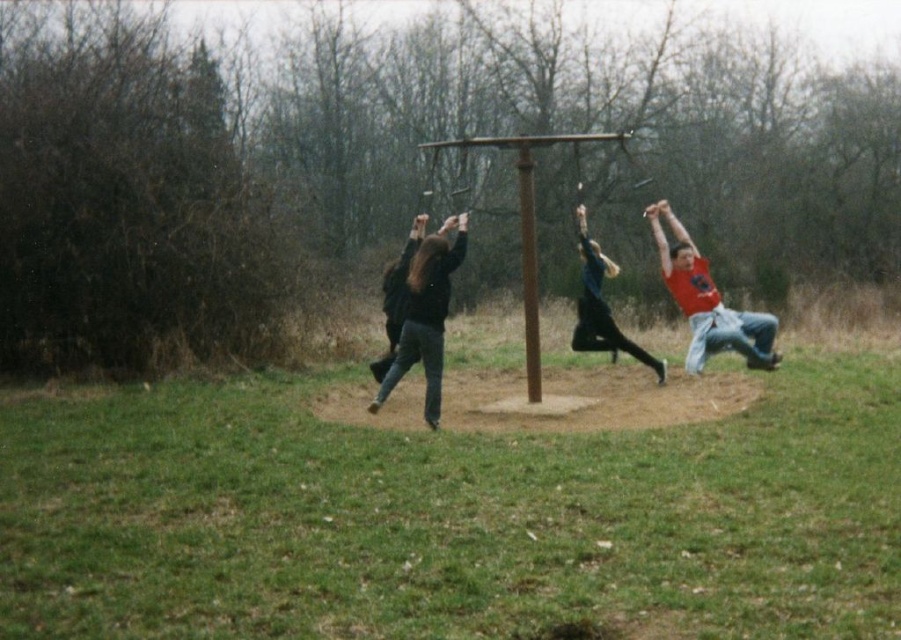
Can you confirm if black matte jacket at center is positioned to the right of black fabric pants at center?

In fact, black matte jacket at center is to the left of black fabric pants at center.

Who is positioned more to the left, black matte jacket at center or black fabric pants at center?

black matte jacket at center

Does point (426, 376) lie in front of point (604, 301)?

Yes, point (426, 376) is in front of point (604, 301).

Where is `black matte jacket at center`? black matte jacket at center is located at coordinates (426, 316).

Does black fabric pants at center appear over brown wooden pole at center?

No, black fabric pants at center is not above brown wooden pole at center.

Does black fabric pants at center have a lesser width compared to brown wooden pole at center?

No.

Between point (575, 328) and point (537, 396), which one is positioned behind?

Point (575, 328)

What are the coordinates of `black fabric pants at center` in the screenshot? It's located at (601, 307).

Is point (710, 308) positioned after point (615, 268)?

No, (710, 308) is in front of (615, 268).

Does red matte shirt at right have a smaller size compared to black fabric pants at center?

Incorrect, red matte shirt at right is not smaller in size than black fabric pants at center.

Between point (699, 321) and point (584, 324), which one is positioned in front?

Point (699, 321)

The height and width of the screenshot is (640, 901). Find the location of `red matte shirt at right`. red matte shirt at right is located at coordinates (707, 301).